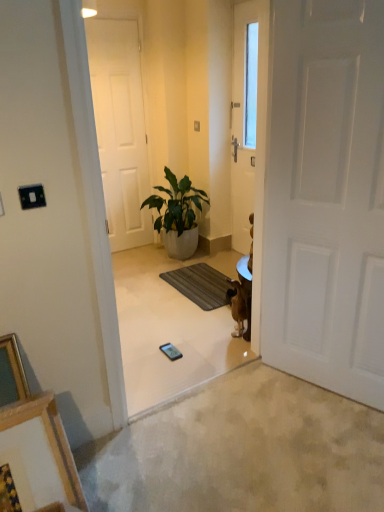
Find the location of `free spot to the left of brown fur dog at center-right`. free spot to the left of brown fur dog at center-right is located at coordinates (208, 336).